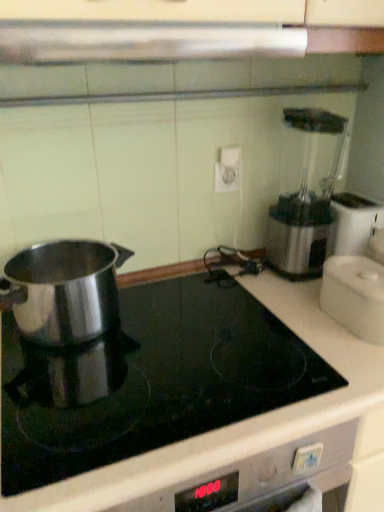
Question: Is polished stainless steel pot at left, arranged as the 2th kitchen appliance when viewed from the right, situated inside satin silver exhaust hood at upper center or outside?

Choices:
 (A) outside
 (B) inside

Answer: (A)

Question: In terms of width, does polished stainless steel pot at left, which appears as the 2th kitchen appliance when viewed from the left, look wider or thinner when compared to satin silver exhaust hood at upper center?

Choices:
 (A) wide
 (B) thin

Answer: (A)

Question: Considering the real-world distances, which object is closest to the white plastic container at right, the third kitchen appliance viewed from the left?

Choices:
 (A) polished stainless steel pot at left, arranged as the 1th kitchen appliance when viewed from the left
 (B) polished stainless steel pot at left, which appears as the 2th kitchen appliance when viewed from the left
 (C) satin silver exhaust hood at upper center

Answer: (B)

Question: Which object is the farthest from the polished stainless steel pot at left, arranged as the third kitchen appliance when viewed from the right?

Choices:
 (A) polished stainless steel pot at left, which appears as the 2th kitchen appliance when viewed from the left
 (B) satin silver exhaust hood at upper center
 (C) white plastic container at right, the third kitchen appliance viewed from the left

Answer: (C)